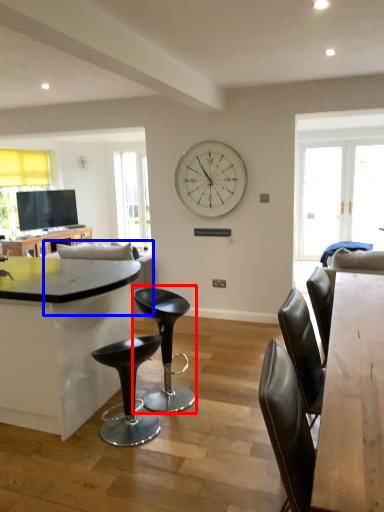
Question: Among these objects, which one is farthest to the camera, chair (highlighted by a red box) or couch (highlighted by a blue box)?

Choices:
 (A) chair
 (B) couch

Answer: (B)